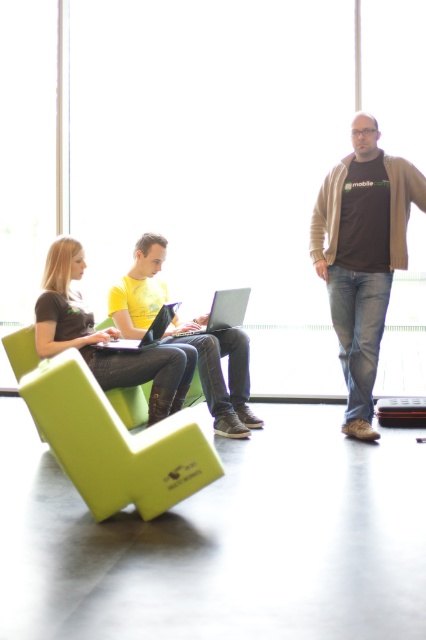
Question: Among these points, which one is nearest to the camera?

Choices:
 (A) (126, 445)
 (B) (138, 301)
 (C) (351, 346)

Answer: (A)

Question: From the image, what is the correct spatial relationship of green foam armchair at lower left in relation to brown cotton t-shirt at right?

Choices:
 (A) right
 (B) left

Answer: (B)

Question: Is matte black laptop at left bigger than yellow matte shirt at center?

Choices:
 (A) yes
 (B) no

Answer: (B)

Question: Can you confirm if matte black laptop at left is positioned below silver metallic laptop at center?

Choices:
 (A) no
 (B) yes

Answer: (B)

Question: Which object is the farthest from the yellow matte shirt at center?

Choices:
 (A) matte black laptop at left
 (B) silver metallic laptop at center
 (C) green foam armchair at lower left

Answer: (C)

Question: Among these points, which one is nearest to the camera?

Choices:
 (A) (161, 316)
 (B) (45, 400)
 (C) (94, 369)

Answer: (B)